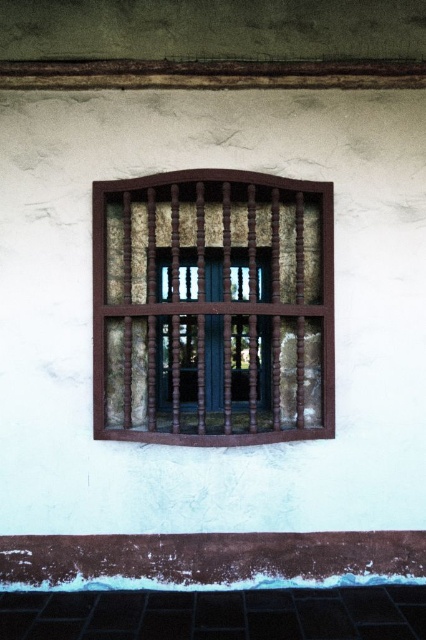
Question: Which of the following is the farthest from the observer?

Choices:
 (A) brown wood at lower center
 (B) brown wooden window frame at center
 (C) brown wooden bars at center

Answer: (A)

Question: Which point is closer to the camera?

Choices:
 (A) brown wood at lower center
 (B) brown wooden window frame at center

Answer: (B)

Question: Observing the image, what is the correct spatial positioning of brown wood at lower center in reference to brown wooden bars at center?

Choices:
 (A) below
 (B) above

Answer: (A)

Question: Is brown wooden window frame at center below brown wood at lower center?

Choices:
 (A) no
 (B) yes

Answer: (A)

Question: Which point appears farthest from the camera in this image?

Choices:
 (A) (135, 323)
 (B) (172, 396)

Answer: (B)

Question: Where is brown wooden window frame at center located in relation to brown wood at lower center in the image?

Choices:
 (A) right
 (B) left

Answer: (B)